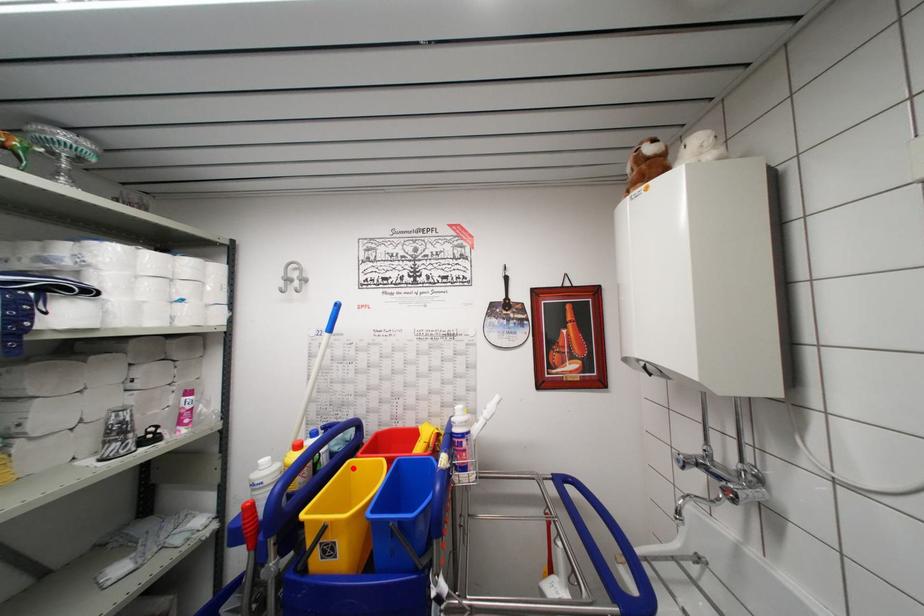
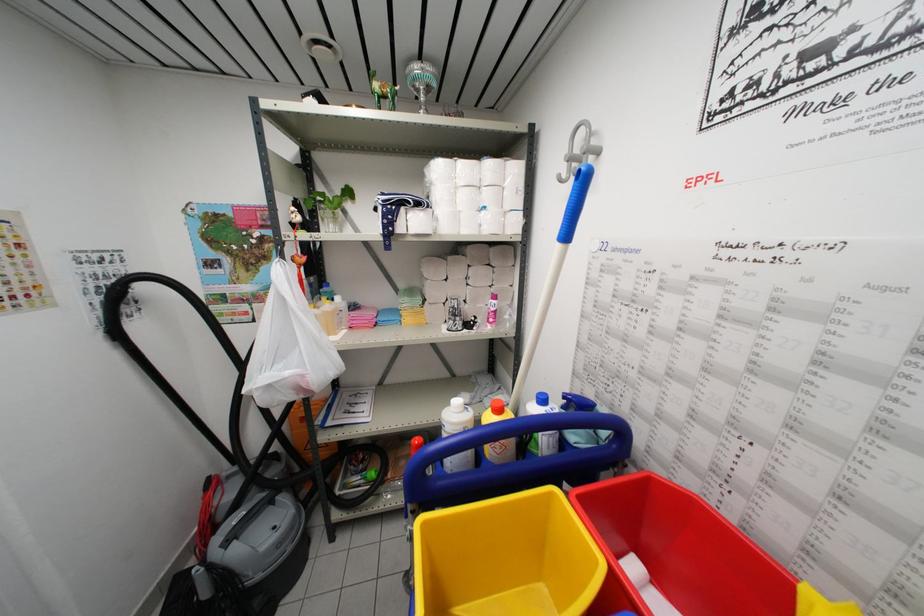
Question: I am providing you with two images of the same scene from different viewpoints. A red point is marked on the first image. Can you still see the location of the red point in image 2?

Choices:
 (A) Yes
 (B) No

Answer: (A)